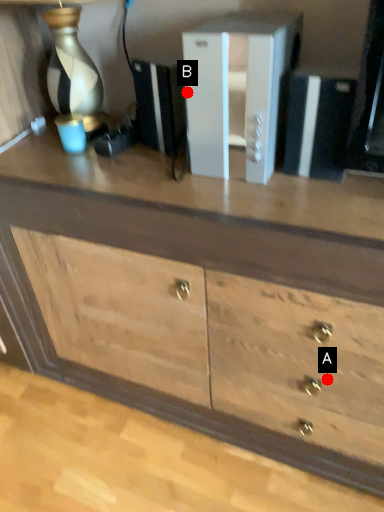
Question: Two points are circled on the image, labeled by A and B beside each circle. Which point appears farthest from the camera in this image?

Choices:
 (A) A is further
 (B) B is further

Answer: (A)